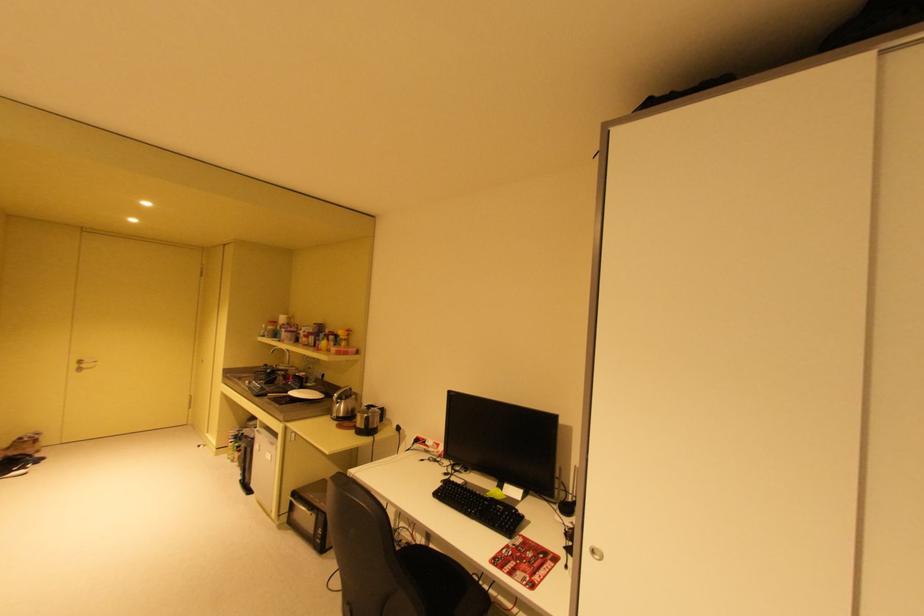
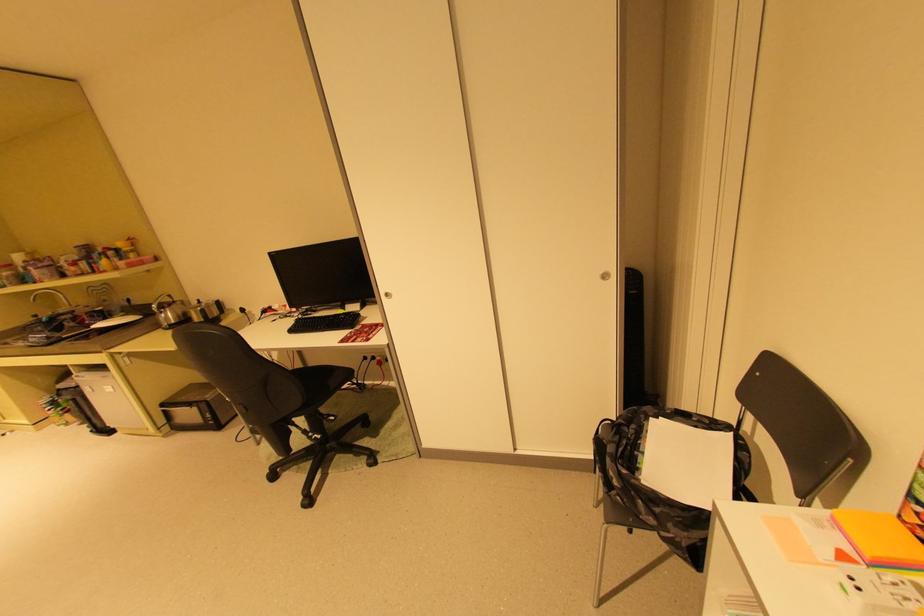
Find the pixel in the second image that matches (x=355, y=411) in the first image.

(187, 317)